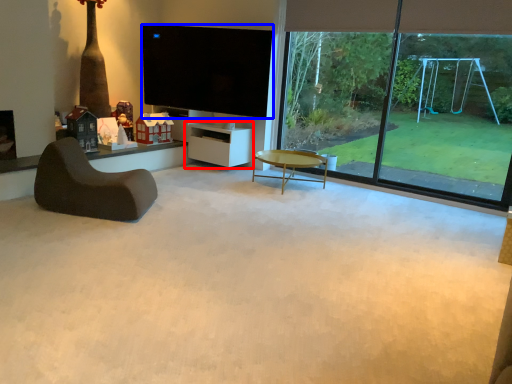
Question: Which object appears farthest to the camera in this image, shelf (highlighted by a red box) or television (highlighted by a blue box)?

Choices:
 (A) shelf
 (B) television

Answer: (A)